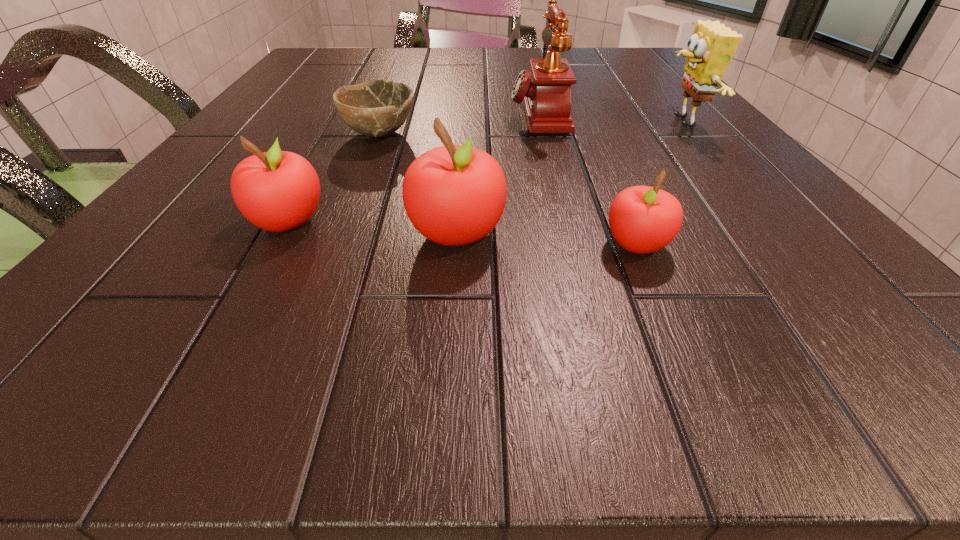
This screenshot has height=540, width=960. Find the location of `the third shortest object`. the third shortest object is located at coordinates [277, 191].

You are a GUI agent. You are given a task and a screenshot of the screen. Output one action in this format:
    pyautogui.click(x=<x>, y=<y>)
    Task: Click on the second shortest apple
    This screenshot has height=540, width=960.
    Given the screenshot: What is the action you would take?
    pyautogui.click(x=277, y=191)

Image resolution: width=960 pixels, height=540 pixels. I want to click on the third object from left to right, so click(454, 195).

Where is `the tallest apple`? the tallest apple is located at coordinates (454, 195).

This screenshot has height=540, width=960. What are the coordinates of `the rightmost apple` in the screenshot? It's located at [x=642, y=219].

Where is `the shortest apple`? the shortest apple is located at coordinates (642, 219).

This screenshot has width=960, height=540. Find the location of `bowl`. bowl is located at coordinates (378, 108).

The image size is (960, 540). Find the location of `sponge`. sponge is located at coordinates (711, 47).

I want to click on telephone, so click(x=546, y=89).

The width and height of the screenshot is (960, 540). I want to click on vacant space located 0.280m on the back of the fourth tallest object, so click(x=344, y=122).